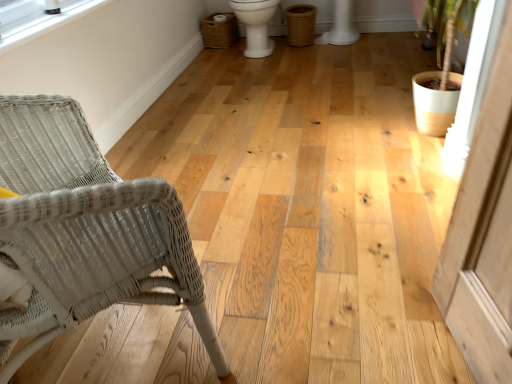
You are a GUI agent. You are given a task and a screenshot of the screen. Output one action in this format:
    pyautogui.click(x=<x>, y=<y>)
    Task: Click on the free point to the right of white wicker chair at left
    
    Given the screenshot: What is the action you would take?
    pyautogui.click(x=285, y=306)